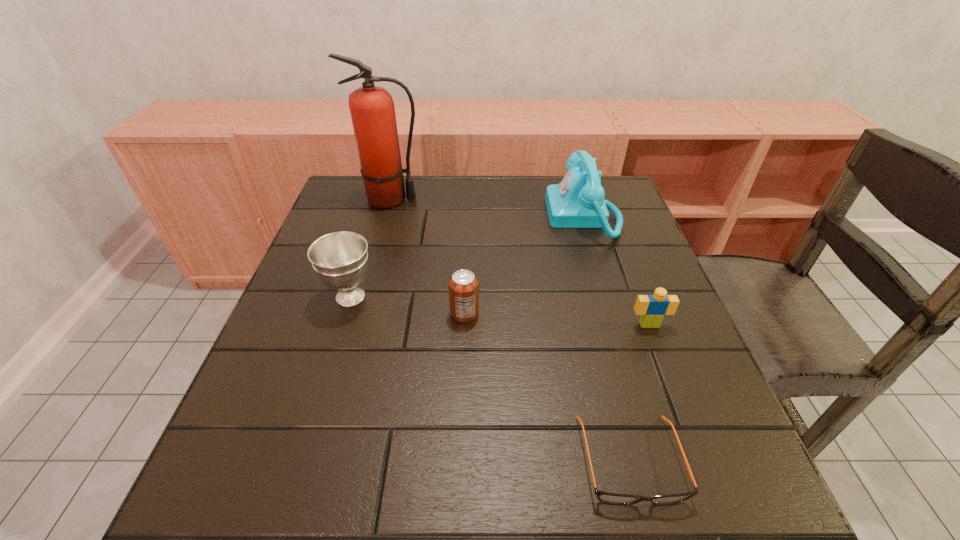
Identify the location of fire extinguisher. (372, 110).

This screenshot has width=960, height=540. Find the location of `telephone`. telephone is located at coordinates (577, 201).

Where is `chalice`? This screenshot has width=960, height=540. chalice is located at coordinates (340, 259).

Where is `the fourth object from right to left`? Image resolution: width=960 pixels, height=540 pixels. the fourth object from right to left is located at coordinates (463, 285).

Locate an element on the screen. This screenshot has width=960, height=540. Lego is located at coordinates (652, 308).

Find the location of a particular element. The height and width of the screenshot is (540, 960). spectacles is located at coordinates (612, 498).

The image size is (960, 540). Find the location of `the shortest object`. the shortest object is located at coordinates (612, 498).

The height and width of the screenshot is (540, 960). Identify the location of free space located on the nozzle of the fire extinguisher. (476, 200).

I want to click on vacant space located 0.110m on the dial of the telephone, so click(x=508, y=216).

Locate an element on the screen. free spot located on the dial of the telephone is located at coordinates (518, 216).